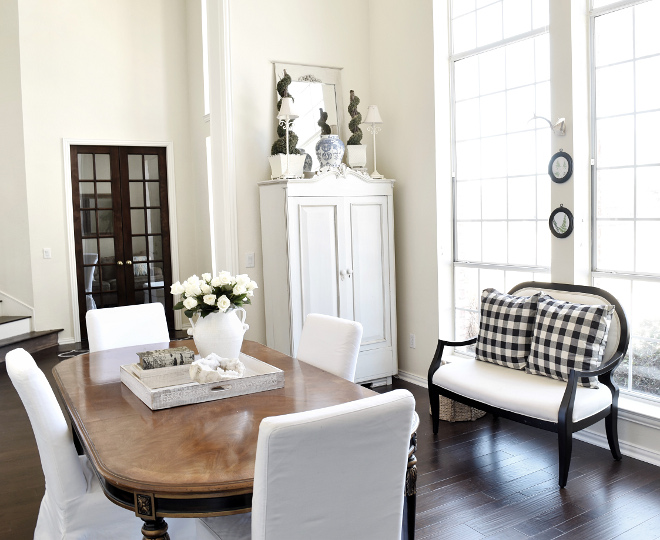
You are a GUI agent. You are given a task and a screenshot of the screen. Output one action in this format:
    pyautogui.click(x=<x>, y=<y>)
    Task: Click on the chairs
    
    Given the screenshot: What is the action you would take?
    tap(360, 458)